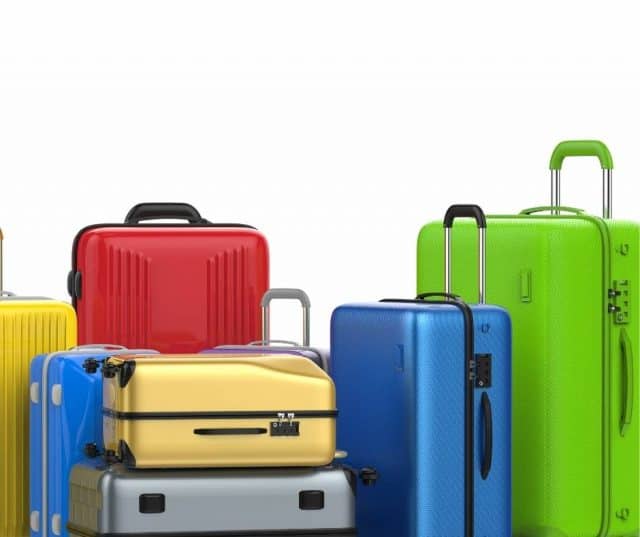
Image resolution: width=640 pixels, height=537 pixels. Find the location of `handles`. handles is located at coordinates (284, 291), (171, 206), (3, 253), (475, 207), (582, 147), (363, 477), (340, 453).